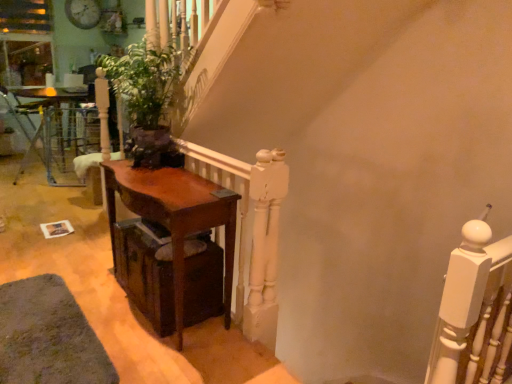
Find the location of `vacant area situated to the left side of dark wood drawer at lower left`. vacant area situated to the left side of dark wood drawer at lower left is located at coordinates (97, 288).